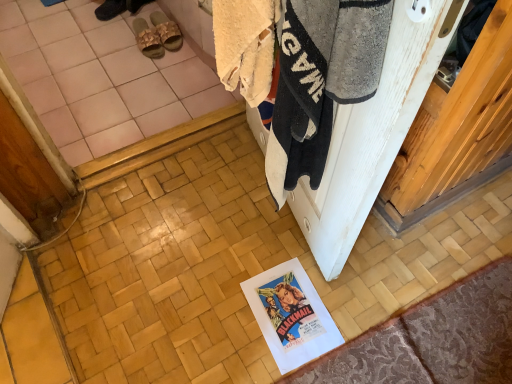
Where is `free point below white paper at lower center (from a real-world perspective)`? The height and width of the screenshot is (384, 512). free point below white paper at lower center (from a real-world perspective) is located at coordinates (291, 319).